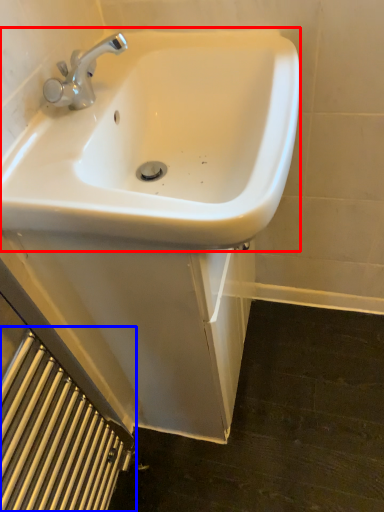
Question: Which object appears closest to the camera in this image, sink (highlighted by a red box) or radiator (highlighted by a blue box)?

Choices:
 (A) sink
 (B) radiator

Answer: (B)